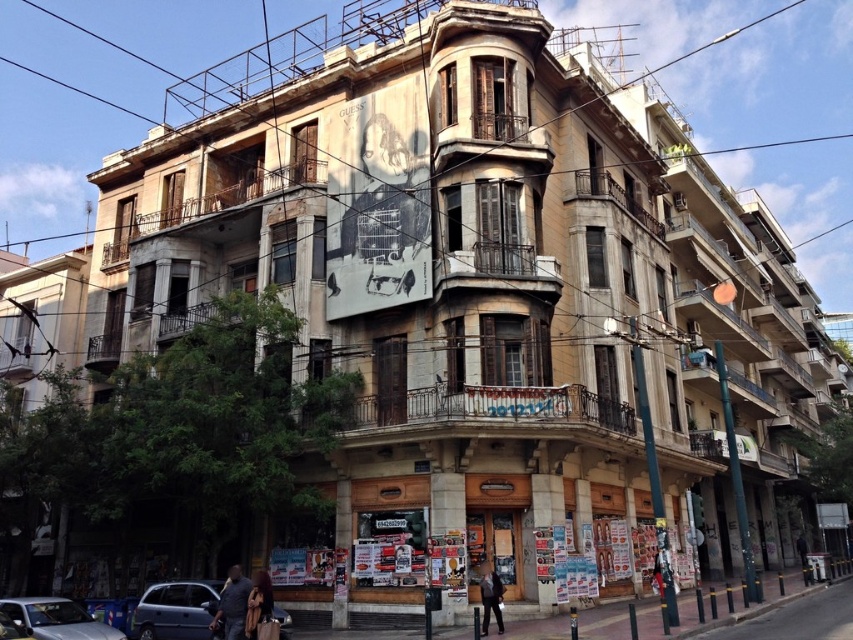
You are a pedestrian standing on the sidewalk in front of the building. You see a matte blue van at lower left and a blue metallic car at lower left. Which vehicle is positioned higher relative to the other?

The matte blue van at lower left is located above the blue metallic car at lower left, so it is positioned higher.

You are standing on the sidewalk in front of the building and see the matte blue van at lower left. What is the color of the vehicle located at point (x=177, y=611)?

The vehicle located at point (x=177, y=611) is the matte blue van at lower left.